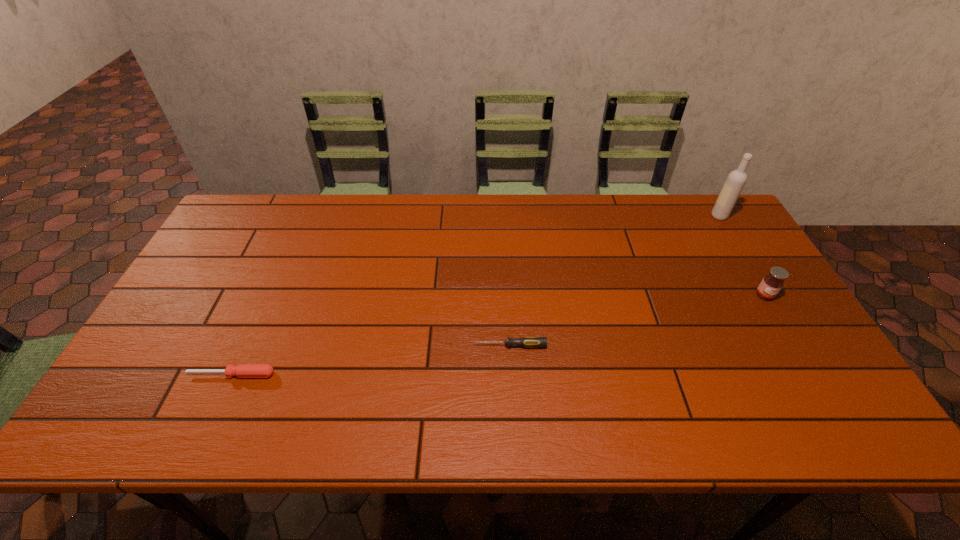
The image size is (960, 540). In the image, there is a desktop. Identify the location of free region at the near edge. [x=702, y=431].

The width and height of the screenshot is (960, 540). I want to click on vacant point at the left edge, so tap(218, 272).

The height and width of the screenshot is (540, 960). In the image, there is a desktop. What are the coordinates of `blank space at the right edge` in the screenshot? It's located at (787, 341).

Find the location of a particular element. vacant space at the far left corner is located at coordinates (260, 198).

Where is `vacant space at the near left corner`? vacant space at the near left corner is located at coordinates (113, 413).

Locate an element on the screen. The height and width of the screenshot is (540, 960). vacant space that's between the tallest object and the farther screwdriver is located at coordinates (614, 281).

Where is `free space between the vodka and the third shortest object`? The height and width of the screenshot is (540, 960). free space between the vodka and the third shortest object is located at coordinates (742, 255).

The height and width of the screenshot is (540, 960). I want to click on unoccupied position between the nearer screwdriver and the farther screwdriver, so click(x=371, y=360).

Identify the location of vacant region between the nearest object and the second nearest object. The width and height of the screenshot is (960, 540). (371, 360).

The width and height of the screenshot is (960, 540). Identify the location of free point between the leftmost object and the third nearest object. (498, 335).